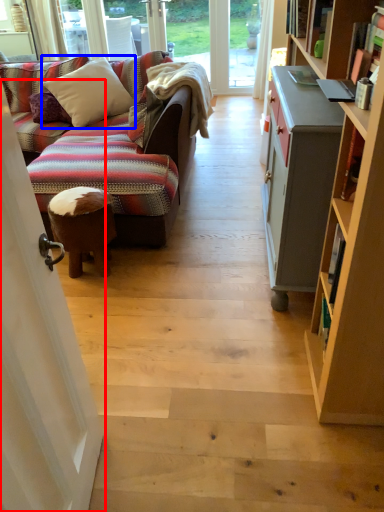
Question: Which of the following is the farthest to the observer, screen door (highlighted by a red box) or pillow (highlighted by a blue box)?

Choices:
 (A) screen door
 (B) pillow

Answer: (B)